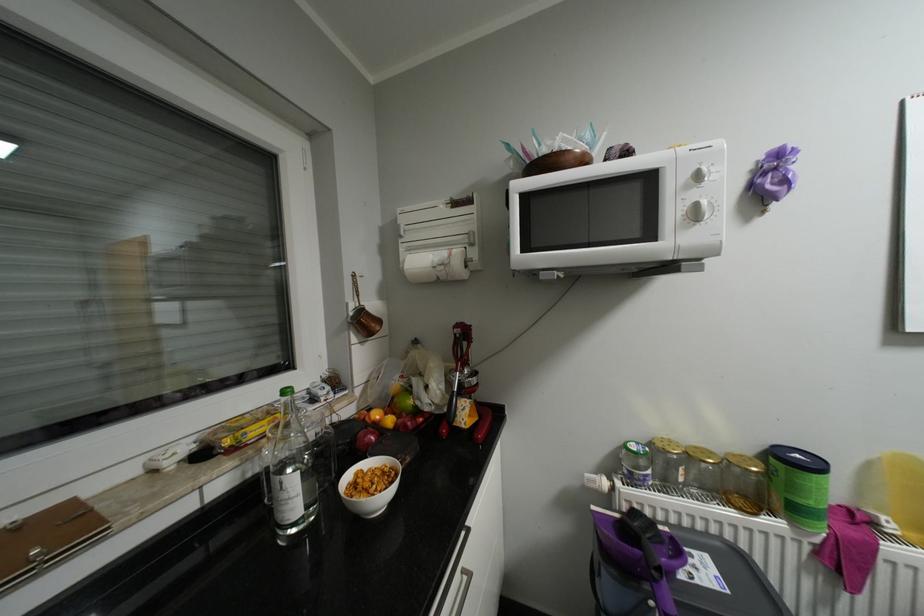
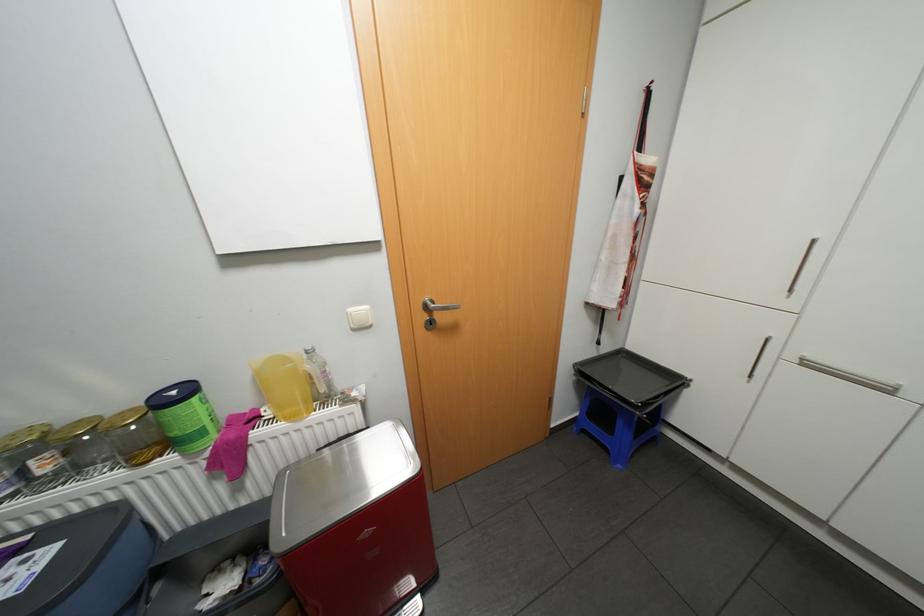
The point at (703,447) is marked in the first image. Where is the corresponding point in the second image?

(88, 419)